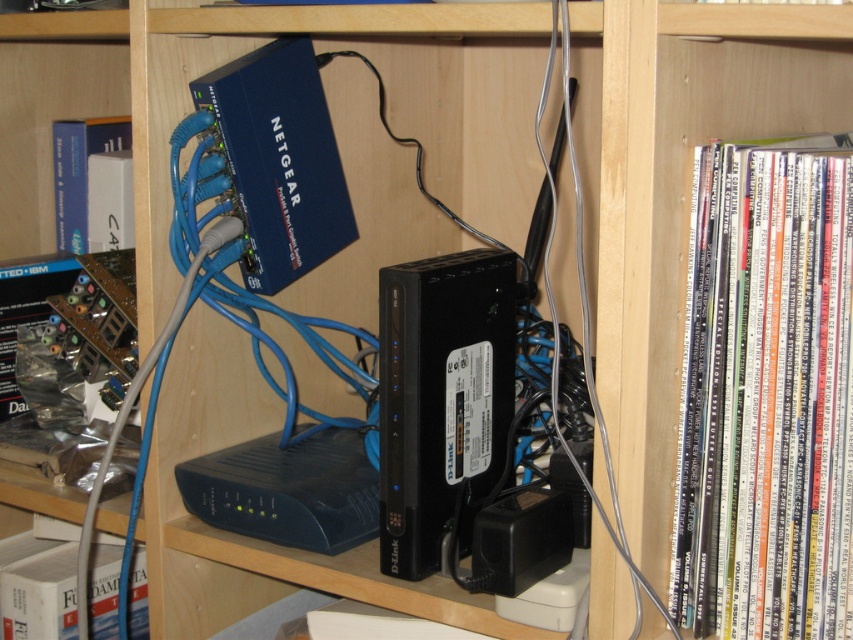
Is white paperbacks at right above white matte book at left?

Incorrect, white paperbacks at right is not positioned above white matte book at left.

Is white paperbacks at right bigger than white matte book at left?

Yes, white paperbacks at right is bigger than white matte book at left.

Is point (699, 221) positioned behind point (122, 138)?

No.

You are a GUI agent. You are given a task and a screenshot of the screen. Output one action in this format:
    pyautogui.click(x=<x>, y=<y>)
    Task: Click on the white paperbacks at right
    
    Given the screenshot: What is the action you would take?
    pyautogui.click(x=766, y=394)

Where is `white paper book at lower left`? white paper book at lower left is located at coordinates (39, 595).

Can you confirm if white paper book at lower left is taller than white matte book at left?

In fact, white paper book at lower left may be shorter than white matte book at left.

Between point (22, 557) and point (93, 131), which one is positioned behind?

Positioned behind is point (93, 131).

Where is `white paper book at lower left`? Image resolution: width=853 pixels, height=640 pixels. white paper book at lower left is located at coordinates (39, 595).

Between point (711, 602) and point (57, 554), which one is positioned behind?

The point (57, 554) is behind.

Who is positioned more to the left, white paperbacks at right or white paper book at lower left?

Positioned to the left is white paper book at lower left.

The image size is (853, 640). What do you see at coordinates (766, 394) in the screenshot?
I see `white paperbacks at right` at bounding box center [766, 394].

Locate an element on the screen. Image resolution: width=853 pixels, height=640 pixels. white paperbacks at right is located at coordinates (766, 394).